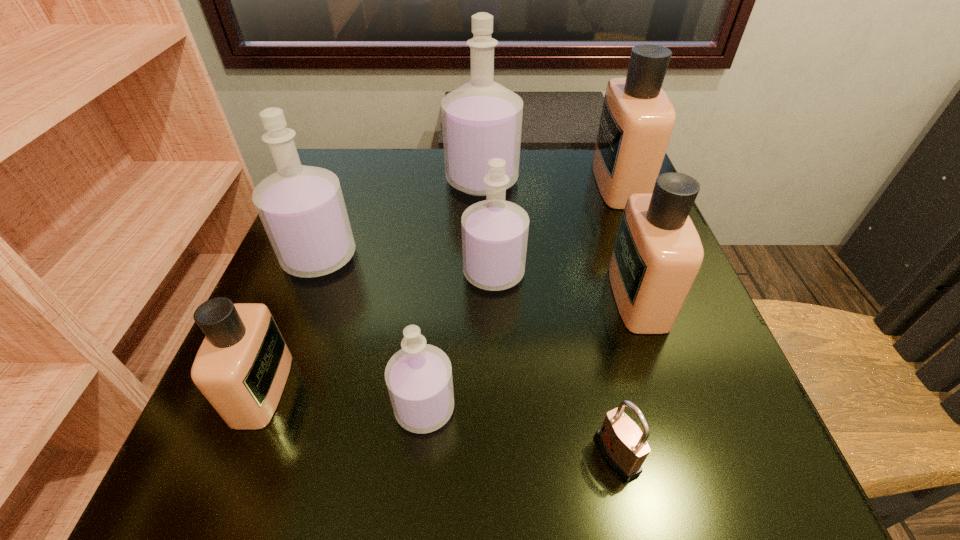
Where is `vacant region that satisfies the following two spatial constraints: 1. on the front side of the third biggest purple perfume; 2. on the front label of the smallest beige perfume`? vacant region that satisfies the following two spatial constraints: 1. on the front side of the third biggest purple perfume; 2. on the front label of the smallest beige perfume is located at coordinates (497, 389).